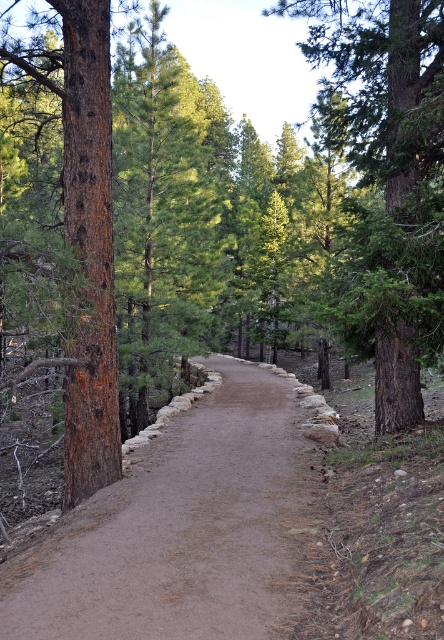
Is dirt path at center closer to the viewer compared to green rough bark tree at center?

Yes, it is.

Does dirt path at center appear on the right side of green rough bark tree at center?

Incorrect, dirt path at center is not on the right side of green rough bark tree at center.

This screenshot has width=444, height=640. Describe the element at coordinates (178, 529) in the screenshot. I see `dirt path at center` at that location.

Where is `dirt path at center`? dirt path at center is located at coordinates (178, 529).